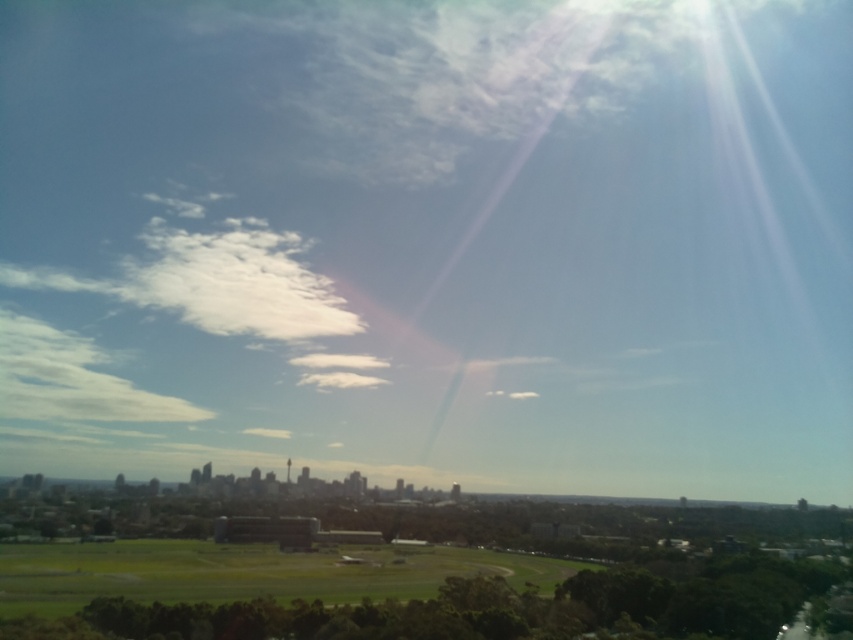
Is green grassy field at lower left bigger than white fluffy cloud at upper left?

Indeed, green grassy field at lower left has a larger size compared to white fluffy cloud at upper left.

Is point (105, 550) farther from viewer compared to point (51, 397)?

That is False.

Locate an element on the screen. This screenshot has width=853, height=640. green grassy field at lower left is located at coordinates (244, 572).